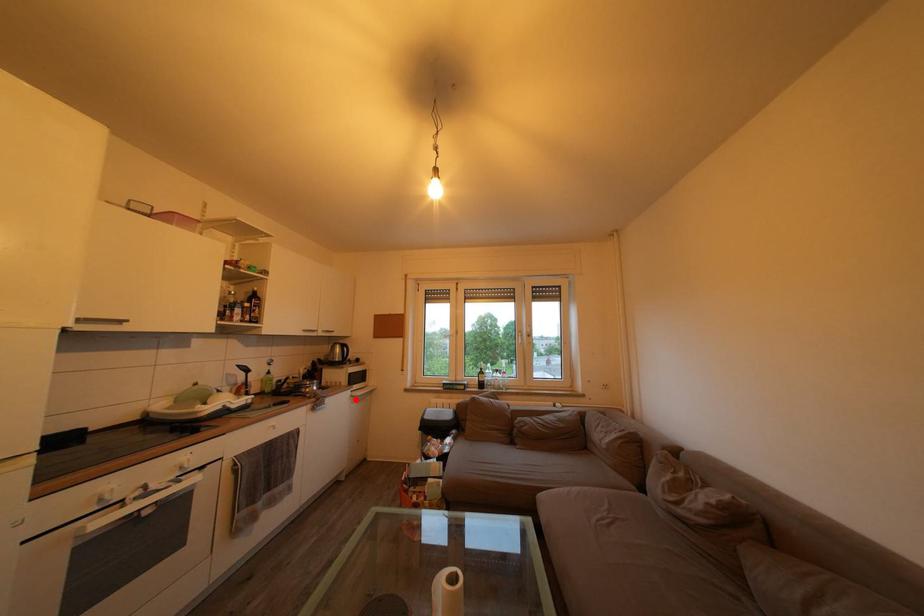
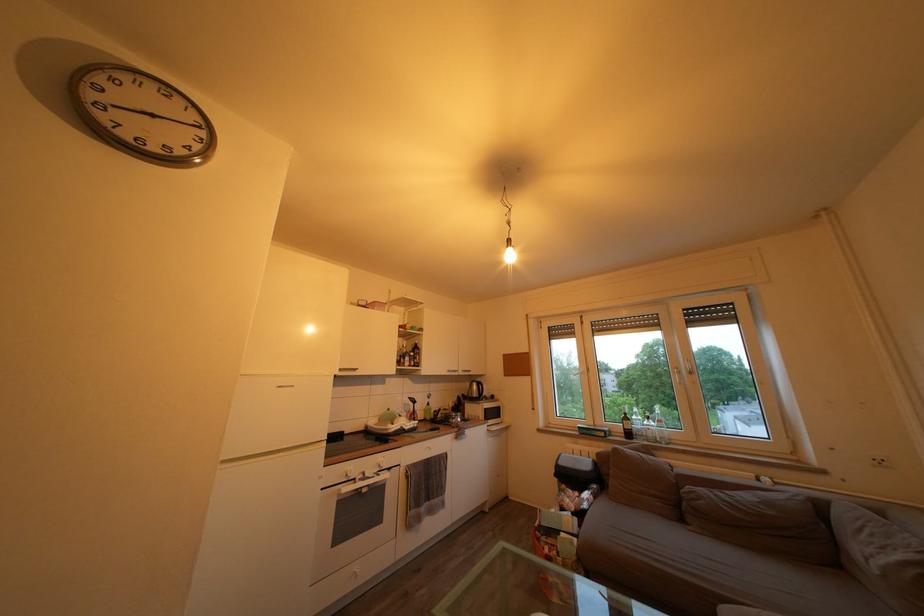
Question: I am providing you with two images of the same scene from different viewpoints. Given a red point in image1, look at the same physical point in image2. Is it:

Choices:
 (A) Closer to the viewpoint
 (B) Farther from the viewpoint

Answer: (B)